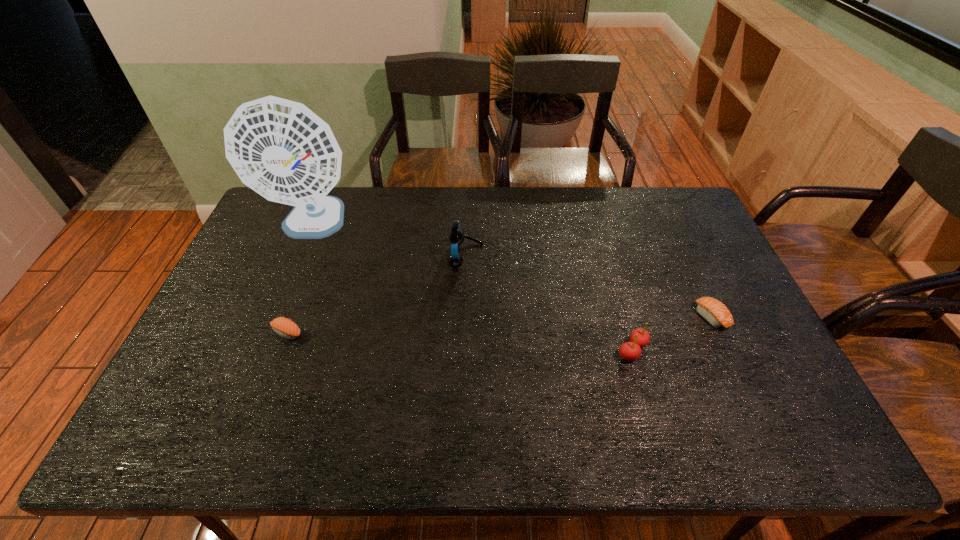
The height and width of the screenshot is (540, 960). Identify the location of vacant position in the image that satisfies the following two spatial constraints: 1. with the microphone attached to the side of the right sushi; 2. on the right side of the fourth shortest object. (465, 316).

Image resolution: width=960 pixels, height=540 pixels. What are the coordinates of `blank area in the image that satisfies the following two spatial constraints: 1. on the back side of the second object from right to left; 2. with the microphone attached to the side of the third object from left to right` in the screenshot? It's located at (605, 256).